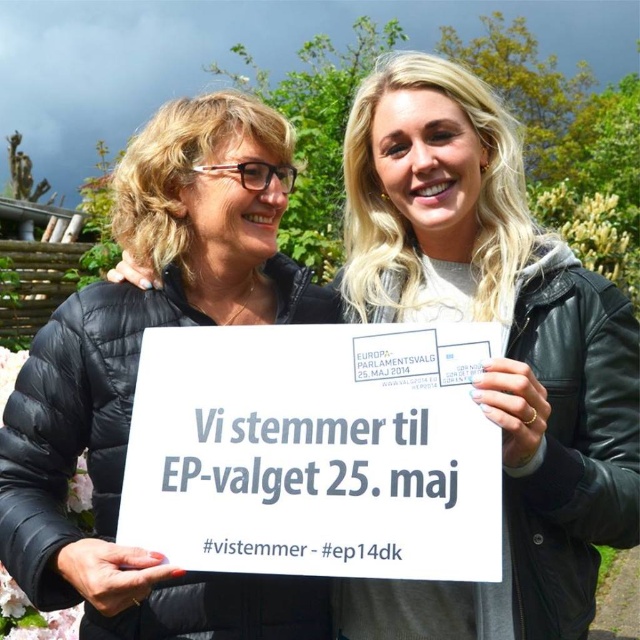
Is point (349, 252) closer to viewer compared to point (241, 300)?

That is False.

Is point (525, 536) positioned behind point (97, 442)?

No, it is not.

In order to click on white matte sign at center in this screenshot , I will do `click(493, 362)`.

Find the location of a particular element. The width and height of the screenshot is (640, 640). white matte sign at center is located at coordinates (493, 362).

Which is more to the right, white paper sign at center or black quilted jacket at left?

From the viewer's perspective, white paper sign at center appears more on the right side.

Is white paper sign at center positioned in front of black quilted jacket at left?

Yes.

Where is `white paper sign at center`? white paper sign at center is located at coordinates (316, 451).

Is white matte sign at center smaller than white paper sign at center?

No, white matte sign at center is not smaller than white paper sign at center.

Can you confirm if white matte sign at center is thinner than white paper sign at center?

Yes.

The width and height of the screenshot is (640, 640). Identify the location of white matte sign at center. pyautogui.click(x=493, y=362).

Where is `white matte sign at center`? The image size is (640, 640). white matte sign at center is located at coordinates (493, 362).